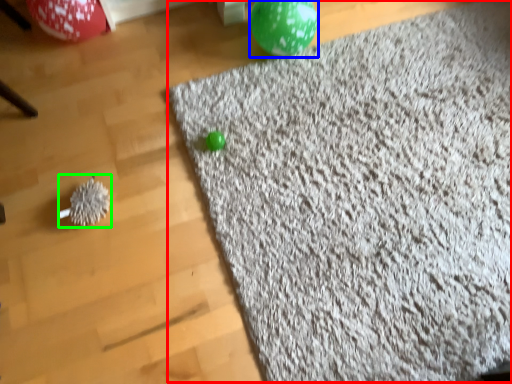
Question: Based on their relative distances, which object is nearer to mat (highlighted by a red box)? Choose from balloon (highlighted by a blue box) and toy (highlighted by a green box).

Choices:
 (A) balloon
 (B) toy

Answer: (A)